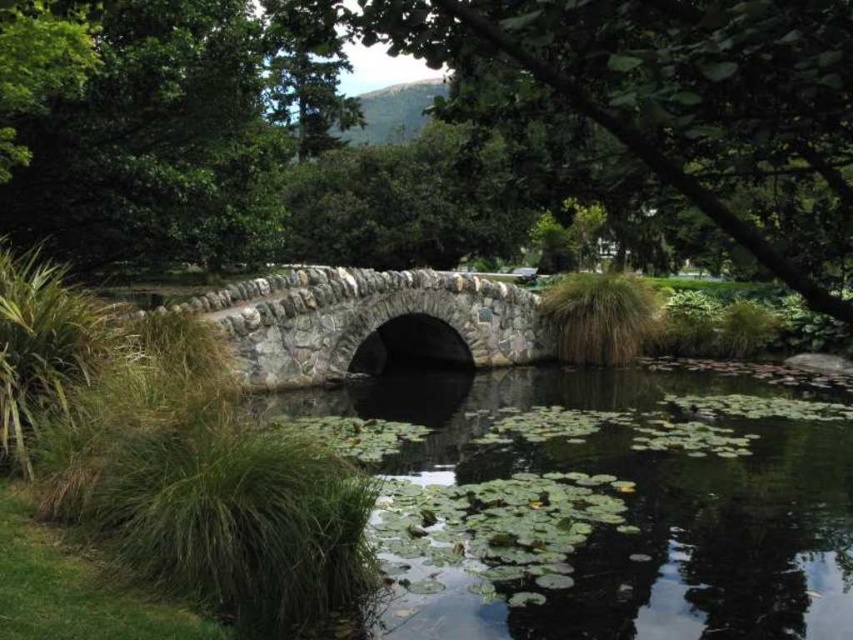
You are a photographer wanting to capture the entire stone textured bridge at center and the green leafy water at center in a single frame. Given that your camera has a fixed field of view, which object should you focus on to ensure both are fully visible?

To capture both the stone textured bridge at center and the green leafy water at center in a single frame, focus on the stone textured bridge at center since the green leafy water at center is wider and will naturally encompass the narrower bridge within the frame.

You are standing on the stone bridge at the center of the image. Looking down, you notice a point marked at coordinates (601,504). What is located at this point?

The point at coordinates (601,504) marks green leafy water at center.

You are a small frog that wants to jump from the green leafy water at center to the stone textured bridge at center. Can you reach the bridge from the water?

The green leafy water at center has a lesser height compared to the stone textured bridge at center, so the frog can jump from the green leafy water at center to the stone textured bridge at center since the bridge is higher.